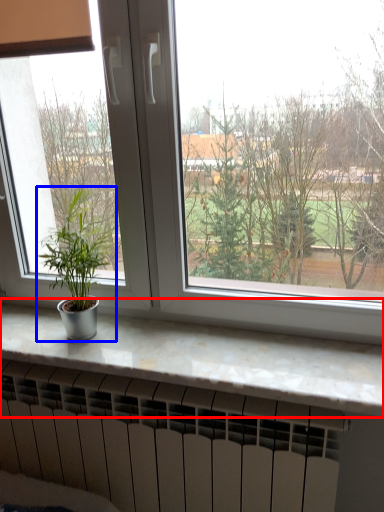
Question: Among these objects, which one is farthest to the camera, counter top (highlighted by a red box) or houseplant (highlighted by a blue box)?

Choices:
 (A) counter top
 (B) houseplant

Answer: (B)